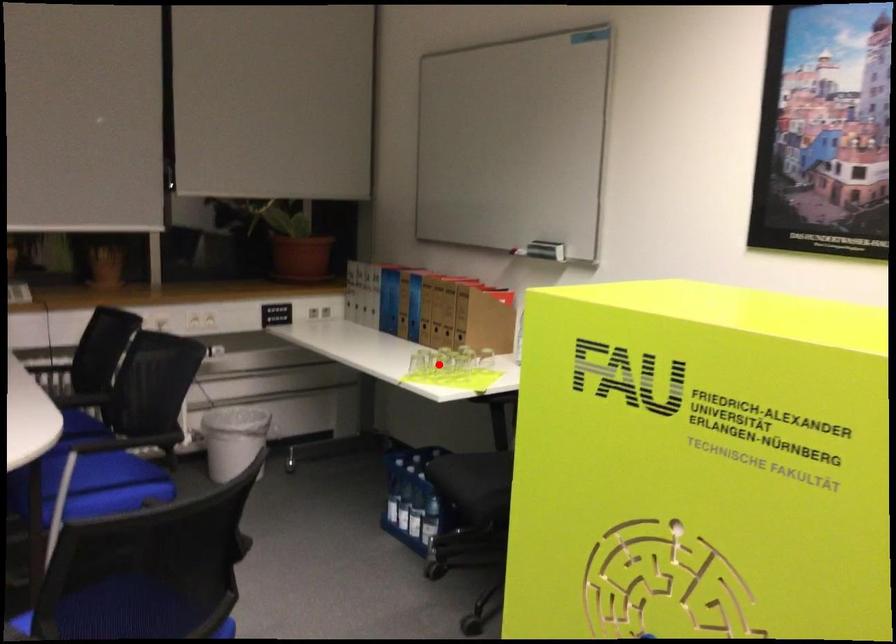
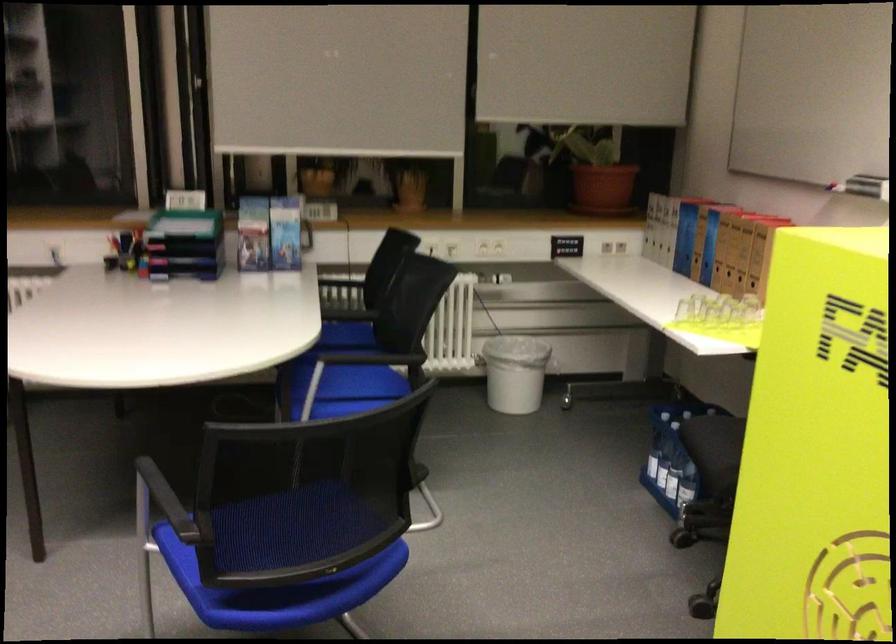
The point at the highlighted location is marked in the first image. Where is the corresponding point in the second image?

(713, 310)